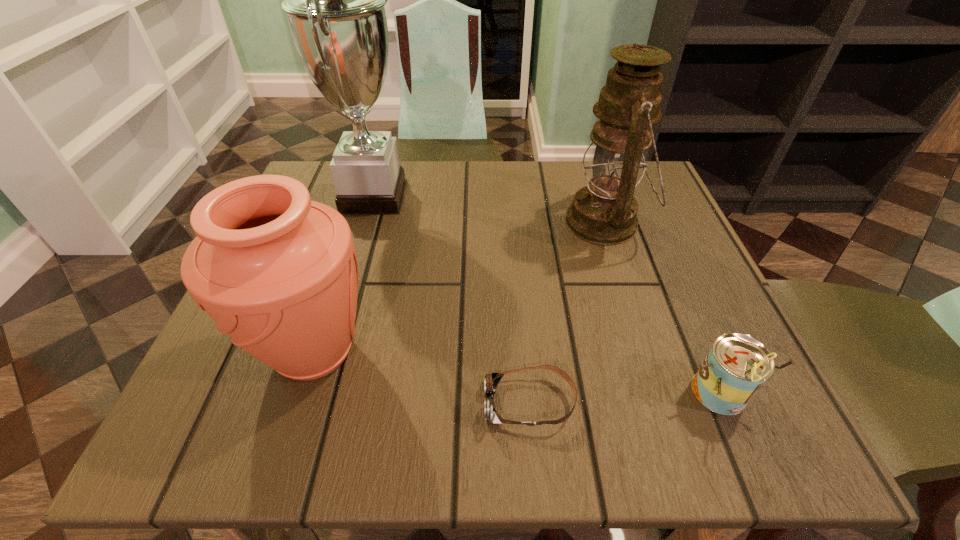
Locate an element on the screen. Image resolution: width=960 pixels, height=540 pixels. the closest object relative to the goggles is located at coordinates (736, 367).

Locate an element on the screen. vacant space that satisfies the following two spatial constraints: 1. at the front view of the trophy cup; 2. on the left side of the fourth shortest object is located at coordinates (x=366, y=222).

Locate an element on the screen. The width and height of the screenshot is (960, 540). vacant area in the image that satisfies the following two spatial constraints: 1. at the front view of the trophy cup; 2. on the right side of the second tallest object is located at coordinates (366, 222).

At what (x,y) coordinates should I click in order to perform the action: click on vacant space that satisfies the following two spatial constraints: 1. at the front view of the tallest object; 2. on the left side of the fourth tallest object. Please return your answer as a coordinate pair (x, y). Looking at the image, I should click on (315, 394).

Where is `vacant point that satisfies the following two spatial constraints: 1. on the back side of the can; 2. at the front view of the tallest object`? vacant point that satisfies the following two spatial constraints: 1. on the back side of the can; 2. at the front view of the tallest object is located at coordinates (x=635, y=197).

Where is `vacant space that satisfies the following two spatial constraints: 1. on the front side of the second shortest object; 2. on the left side of the vase`? Image resolution: width=960 pixels, height=540 pixels. vacant space that satisfies the following two spatial constraints: 1. on the front side of the second shortest object; 2. on the left side of the vase is located at coordinates (300, 394).